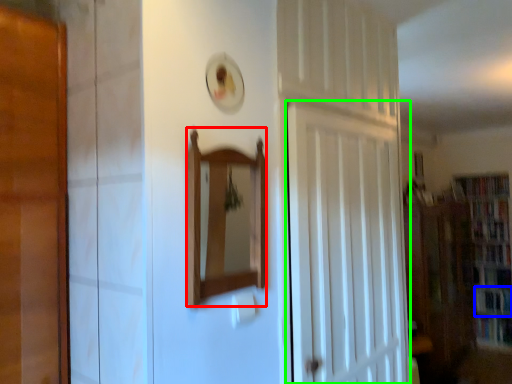
Question: Which object is positioned farthest from mirror (highlighted by a red box)? Select from book (highlighted by a blue box) and door (highlighted by a green box).

Choices:
 (A) book
 (B) door

Answer: (A)